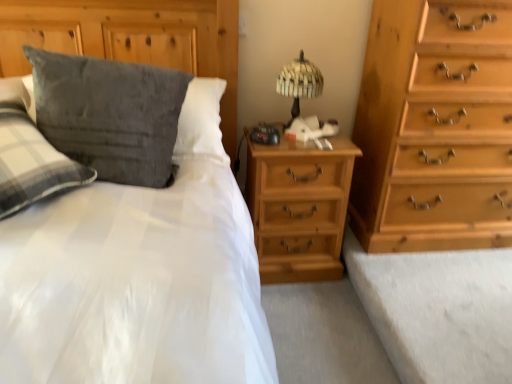
Question: Is suede-like gray pillow at upper left oriented towards velvety gray pillow at upper left?

Choices:
 (A) no
 (B) yes

Answer: (B)

Question: Can you confirm if suede-like gray pillow at upper left is smaller than velvety gray pillow at upper left?

Choices:
 (A) yes
 (B) no

Answer: (B)

Question: Is suede-like gray pillow at upper left positioned with its back to velvety gray pillow at upper left?

Choices:
 (A) yes
 (B) no

Answer: (A)

Question: Considering the relative positions of suede-like gray pillow at upper left and velvety gray pillow at upper left in the image provided, is suede-like gray pillow at upper left to the right of velvety gray pillow at upper left from the viewer's perspective?

Choices:
 (A) yes
 (B) no

Answer: (A)

Question: Is suede-like gray pillow at upper left wider than velvety gray pillow at upper left?

Choices:
 (A) yes
 (B) no

Answer: (A)

Question: Is suede-like gray pillow at upper left behind velvety gray pillow at upper left?

Choices:
 (A) yes
 (B) no

Answer: (A)

Question: Considering the relative positions of light brown wooden chest of drawers at right and woven wood table lamp at upper center in the image provided, is light brown wooden chest of drawers at right to the left of woven wood table lamp at upper center from the viewer's perspective?

Choices:
 (A) no
 (B) yes

Answer: (A)

Question: Considering the relative positions of light brown wooden chest of drawers at right and woven wood table lamp at upper center in the image provided, is light brown wooden chest of drawers at right to the right of woven wood table lamp at upper center from the viewer's perspective?

Choices:
 (A) no
 (B) yes

Answer: (B)

Question: Is light brown wooden chest of drawers at right positioned behind woven wood table lamp at upper center?

Choices:
 (A) no
 (B) yes

Answer: (A)

Question: Is light brown wooden chest of drawers at right next to woven wood table lamp at upper center?

Choices:
 (A) no
 (B) yes

Answer: (A)

Question: Can you confirm if light brown wooden chest of drawers at right is smaller than woven wood table lamp at upper center?

Choices:
 (A) no
 (B) yes

Answer: (A)

Question: From a real-world perspective, is light brown wooden chest of drawers at right beneath woven wood table lamp at upper center?

Choices:
 (A) yes
 (B) no

Answer: (A)

Question: Considering the relative sizes of suede-like gray pillow at upper left and light brown wood nightstand at center in the image provided, is suede-like gray pillow at upper left bigger than light brown wood nightstand at center?

Choices:
 (A) no
 (B) yes

Answer: (B)